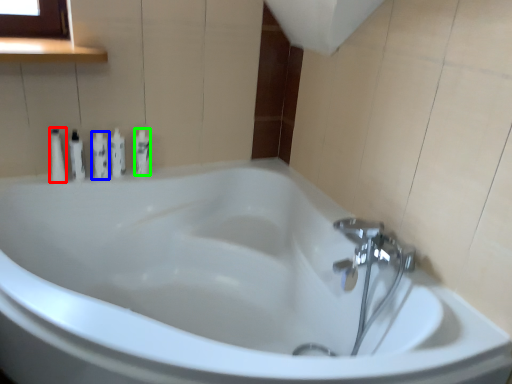
Question: Estimate the real-world distances between objects in this image. Which object is closer to toiletry (highlighted by a red box), toiletry (highlighted by a blue box) or toiletry (highlighted by a green box)?

Choices:
 (A) toiletry
 (B) toiletry

Answer: (A)